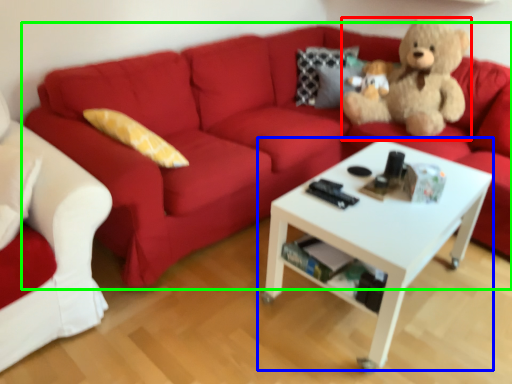
Question: Estimate the real-world distances between objects in this image. Which object is closer to teddy bear (highlighted by a red box), coffee table (highlighted by a blue box) or studio couch (highlighted by a green box)?

Choices:
 (A) coffee table
 (B) studio couch

Answer: (B)